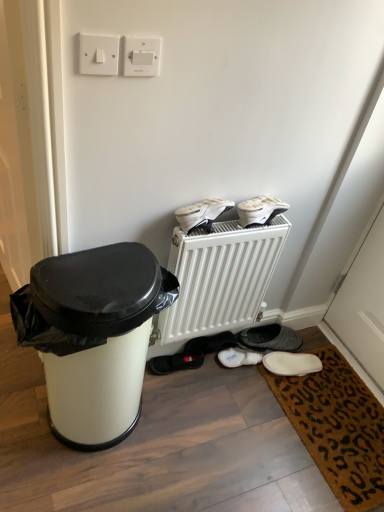
Question: Is white matte sneakers at upper center, arranged as the 2th footwear when viewed from the back, oriented towards white plastic radiator at center?

Choices:
 (A) no
 (B) yes

Answer: (A)

Question: From the image's perspective, is white matte sneakers at upper center, which ranks as the third footwear in bottom-to-top order, on white plastic radiator at center?

Choices:
 (A) yes
 (B) no

Answer: (A)

Question: Is white plastic radiator at center completely or partially inside white matte sneakers at upper center, which ranks as the third footwear in bottom-to-top order?

Choices:
 (A) yes
 (B) no

Answer: (B)

Question: Can you confirm if white matte sneakers at upper center, which ranks as the third footwear in bottom-to-top order, is taller than white plastic radiator at center?

Choices:
 (A) no
 (B) yes

Answer: (A)

Question: Does white matte sneakers at upper center, arranged as the 2th footwear when viewed from the back, appear on the left side of white plastic radiator at center?

Choices:
 (A) no
 (B) yes

Answer: (A)

Question: From a real-world perspective, is white plastic switch at upper center, which appears as the second electric outlet when viewed from the left, positioned above or below brown coir mat at lower right?

Choices:
 (A) above
 (B) below

Answer: (A)

Question: From the image's perspective, relative to brown coir mat at lower right, is white plastic switch at upper center, which appears as the second electric outlet when viewed from the left, above or below?

Choices:
 (A) below
 (B) above

Answer: (B)

Question: Is white plastic switch at upper center, marked as the first electric outlet in a right-to-left arrangement, in front of or behind brown coir mat at lower right in the image?

Choices:
 (A) front
 (B) behind

Answer: (A)

Question: Considering the positions of white plastic switch at upper center, which appears as the second electric outlet when viewed from the left, and brown coir mat at lower right in the image, is white plastic switch at upper center, which appears as the second electric outlet when viewed from the left, taller or shorter than brown coir mat at lower right?

Choices:
 (A) tall
 (B) short

Answer: (A)

Question: Is point (79, 51) positioned closer to the camera than point (137, 38)?

Choices:
 (A) closer
 (B) farther

Answer: (A)

Question: Based on their positions, is white plastic switch at upper left, which appears as the second electric outlet when viewed from the right, located to the left or right of white plastic switch at upper center, marked as the first electric outlet in a right-to-left arrangement?

Choices:
 (A) left
 (B) right

Answer: (A)

Question: Is white plastic switch at upper left, which appears as the second electric outlet when viewed from the right, in front of or behind white plastic switch at upper center, which appears as the second electric outlet when viewed from the left, in the image?

Choices:
 (A) front
 (B) behind

Answer: (A)

Question: Do you think white plastic switch at upper left, which appears as the second electric outlet when viewed from the right, is within white plastic switch at upper center, marked as the first electric outlet in a right-to-left arrangement, or outside of it?

Choices:
 (A) inside
 (B) outside

Answer: (B)

Question: In terms of height, does white plastic switch at upper left, the 1th electric outlet from the left, look taller or shorter compared to white matte sneakers at upper center, the first footwear from the top?

Choices:
 (A) short
 (B) tall

Answer: (B)

Question: Is white plastic switch at upper left, the 1th electric outlet from the left, to the left or to the right of white matte sneakers at upper center, which ranks as the third footwear in bottom-to-top order, in the image?

Choices:
 (A) left
 (B) right

Answer: (A)